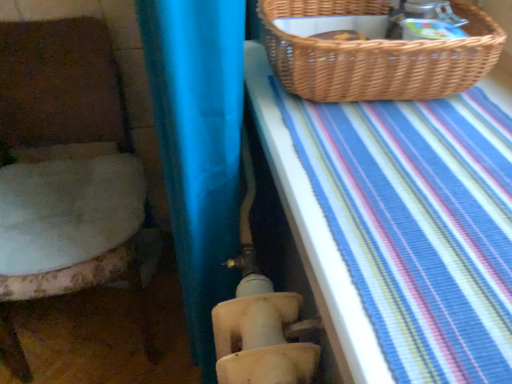
What are the coordinates of `vacant space situated above blue striped fabric at upper right (from a real-world perspective)` in the screenshot? It's located at click(414, 165).